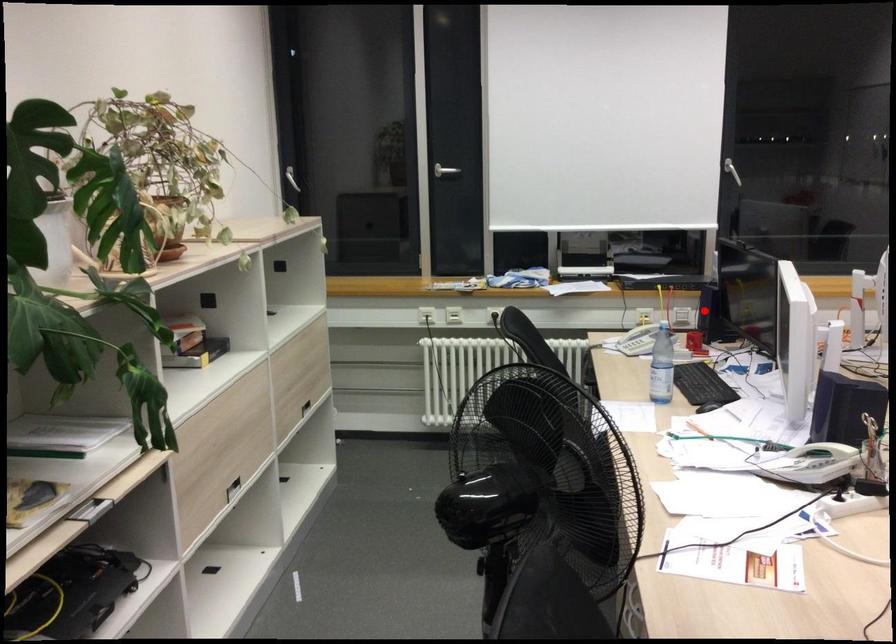
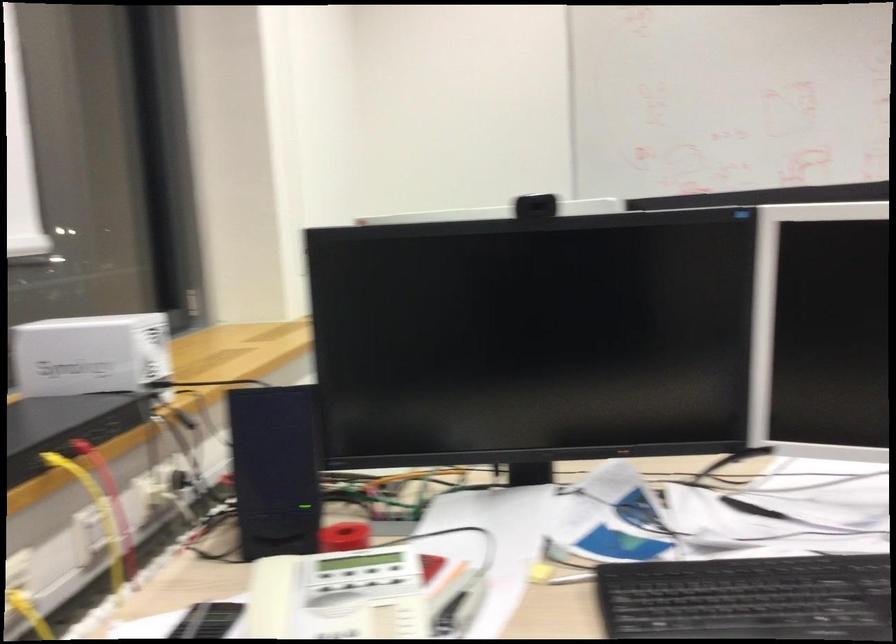
Question: I am providing you with two images of the same scene from different viewpoints. A red point is shown in image1. For the corresponding object point in image2, is it positioned nearer or farther from the camera?

Choices:
 (A) Nearer
 (B) Farther

Answer: (A)